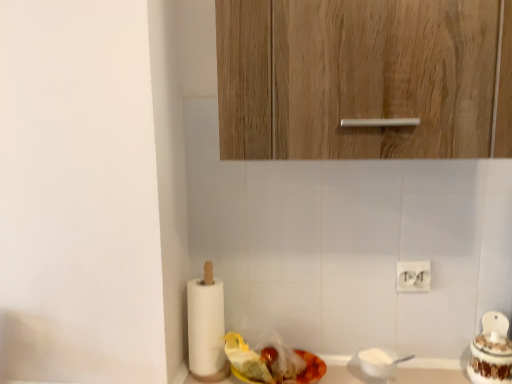
Question: Considering the relative sizes of white glossy cake at right, placed as the 1th food when sorted from right to left, and white plastic electric outlet at lower right in the image provided, is white glossy cake at right, placed as the 1th food when sorted from right to left, bigger than white plastic electric outlet at lower right?

Choices:
 (A) no
 (B) yes

Answer: (B)

Question: Could you tell me if white glossy cake at right, the second food when ordered from left to right, is turned towards white plastic electric outlet at lower right?

Choices:
 (A) yes
 (B) no

Answer: (B)

Question: Is white glossy cake at right, placed as the 1th food when sorted from right to left, at the left side of white plastic electric outlet at lower right?

Choices:
 (A) yes
 (B) no

Answer: (B)

Question: From the image's perspective, is white glossy cake at right, the second food when ordered from left to right, under white plastic electric outlet at lower right?

Choices:
 (A) no
 (B) yes

Answer: (B)

Question: Is white glossy cake at right, the second food when ordered from left to right, next to white plastic electric outlet at lower right?

Choices:
 (A) yes
 (B) no

Answer: (B)

Question: Could white plastic electric outlet at lower right be considered to be inside white glossy cake at right, the second food when ordered from left to right?

Choices:
 (A) no
 (B) yes

Answer: (A)

Question: From the image's perspective, is white plastic electric outlet at lower right over white paper at left?

Choices:
 (A) yes
 (B) no

Answer: (A)

Question: Is white plastic electric outlet at lower right shorter than white paper at left?

Choices:
 (A) yes
 (B) no

Answer: (A)

Question: From the image's perspective, is white plastic electric outlet at lower right beneath white paper at left?

Choices:
 (A) yes
 (B) no

Answer: (B)

Question: Does white plastic electric outlet at lower right have a greater width compared to white paper at left?

Choices:
 (A) no
 (B) yes

Answer: (A)

Question: Is the depth of white plastic electric outlet at lower right less than that of white paper at left?

Choices:
 (A) yes
 (B) no

Answer: (B)

Question: Considering the relative positions of white plastic electric outlet at lower right and white paper at left in the image provided, is white plastic electric outlet at lower right behind white paper at left?

Choices:
 (A) no
 (B) yes

Answer: (B)

Question: Does white paper at left appear on the right side of shiny plastic container at lower center, which is the first food in left-to-right order?

Choices:
 (A) yes
 (B) no

Answer: (B)